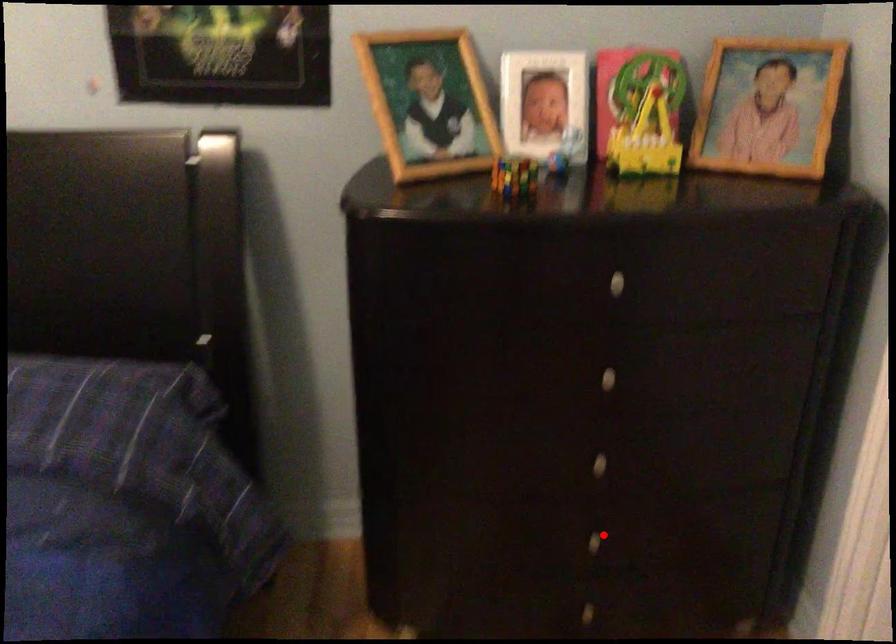
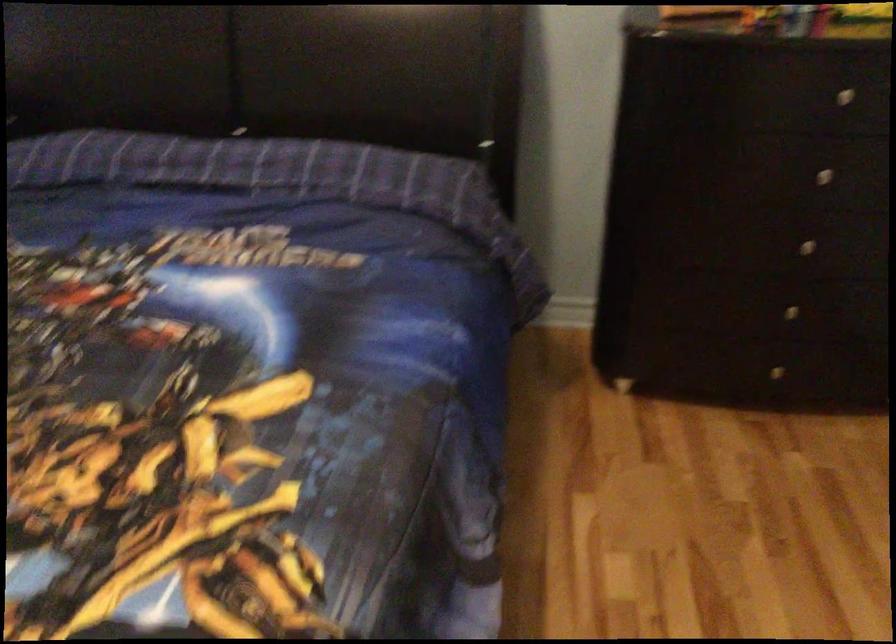
Question: I am providing you with two images of the same scene from different viewpoints. Given a red point in image1, look at the same physical point in image2. Is it:

Choices:
 (A) Closer to the viewpoint
 (B) Farther from the viewpoint

Answer: (B)